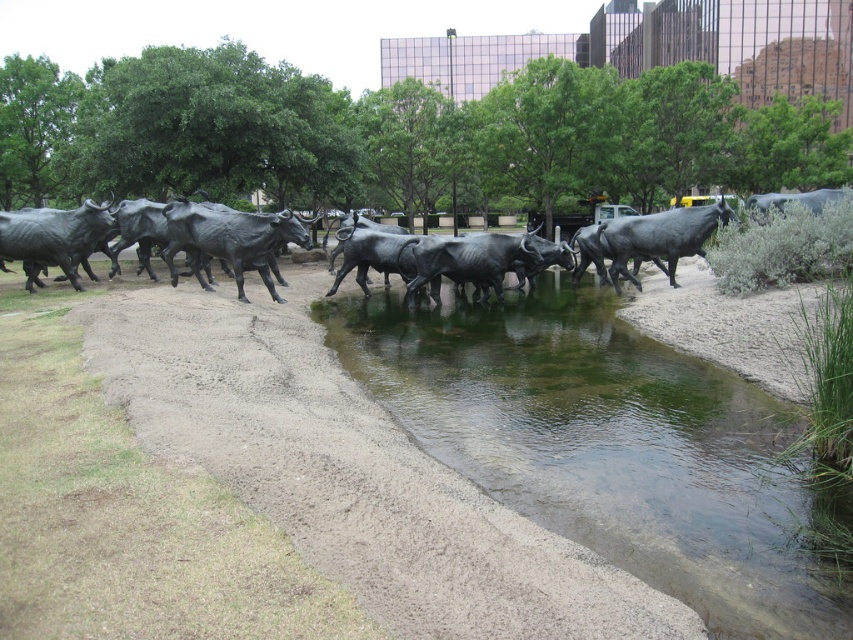
You are standing at the edge of the reflective water and see the polished bronze bull at center and the polished bronze bull at right. Which bull is positioned closer to the water?

The polished bronze bull at center is positioned closer to the water because it is below the polished bronze bull at right.

Looking at this image, you are an artist planning to paint this scene. You want to ensure the proportions between the clear water at center and the polished bronze bull at center are accurate. Which one should you paint wider in your artwork?

The clear water at center should be painted wider than the polished bronze bull at center because its width is larger according to the description.

You are standing in front of the bronze cattle sculptures facing the reflective water. There are two points marked on the water surface at coordinates point (596, 308) and point (437, 301). Which point is closer to your viewpoint?

Point (596, 308) is closer to the camera than point (437, 301).